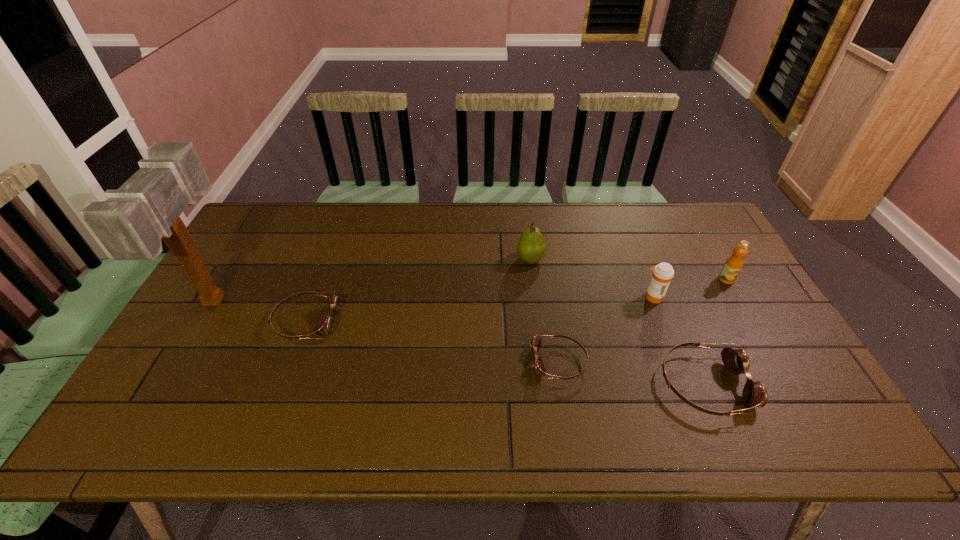
Locate an element on the screen. The height and width of the screenshot is (540, 960). vacant position for inserting another goggles evenly is located at coordinates (427, 341).